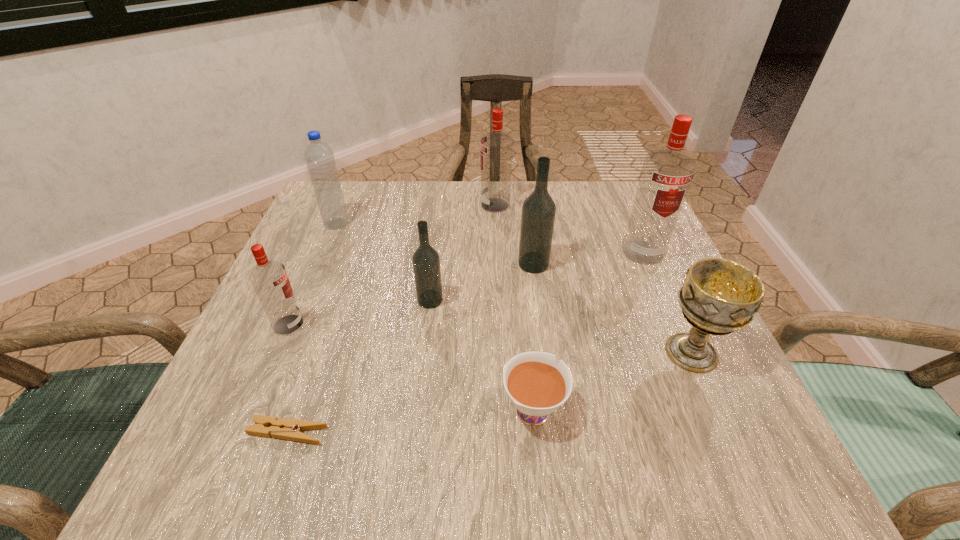
Find the location of a particular element. vacant region at the far edge of the desktop is located at coordinates (459, 230).

Locate an element on the screen. The height and width of the screenshot is (540, 960). free space at the near edge is located at coordinates (643, 441).

In the image, there is a desktop. At what (x,y) coordinates should I click in order to perform the action: click on vacant region at the left edge. Please return your answer as a coordinate pair (x, y). The image size is (960, 540). Looking at the image, I should click on (324, 376).

The image size is (960, 540). Find the location of `vacant space at the right edge of the desktop`. vacant space at the right edge of the desktop is located at coordinates (660, 322).

This screenshot has width=960, height=540. Find the location of `blank space at the far left corner`. blank space at the far left corner is located at coordinates (376, 198).

The width and height of the screenshot is (960, 540). I want to click on vacant space at the near left corner, so click(214, 479).

Identify the location of free point at the far right corner. (628, 206).

The height and width of the screenshot is (540, 960). In order to click on free spot between the eighth tallest object and the fourth vodka from left to right in this screenshot , I will do `click(533, 335)`.

Where is `free space between the bigger black vodka and the farthest vodka`? Image resolution: width=960 pixels, height=540 pixels. free space between the bigger black vodka and the farthest vodka is located at coordinates (515, 234).

At what (x,y) coordinates should I click in order to perform the action: click on vacant area that lies between the second shortest object and the leftmost vodka. Please return your answer as a coordinate pair (x, y). Looking at the image, I should click on pos(411,366).